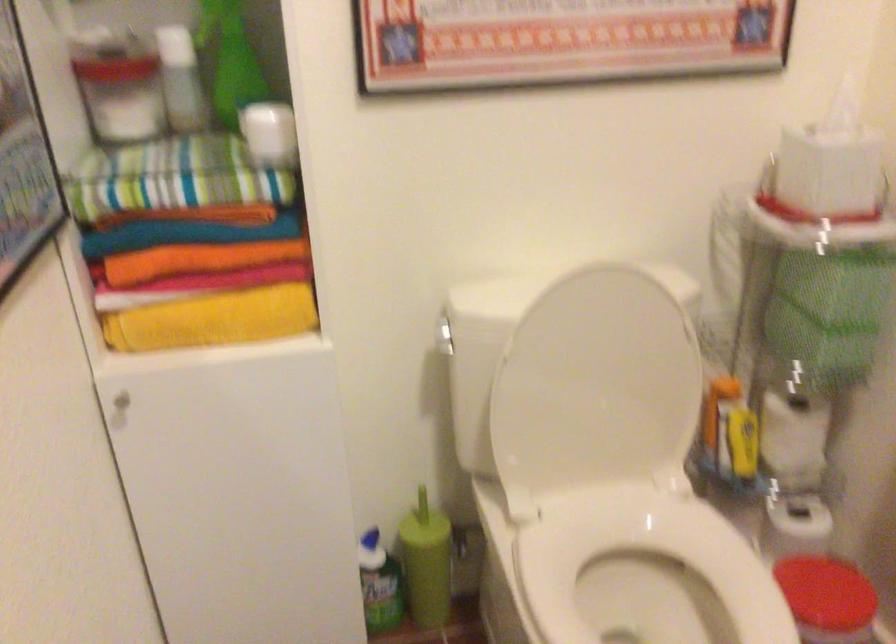
Find the location of a particular element. yellow plastic bottle is located at coordinates (743, 440).